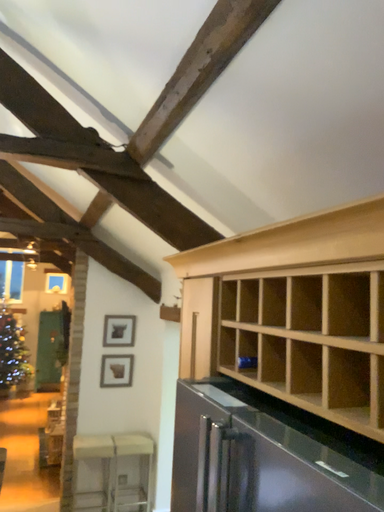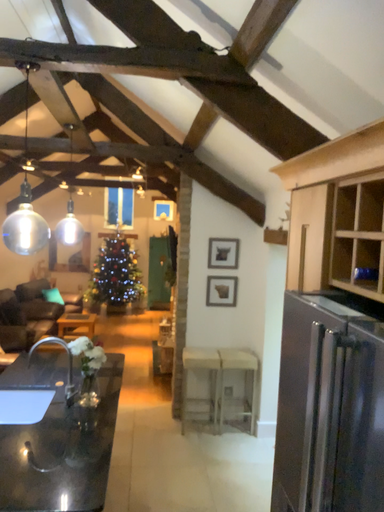
Question: Which way did the camera rotate in the video?

Choices:
 (A) rotated downward
 (B) rotated upward

Answer: (A)